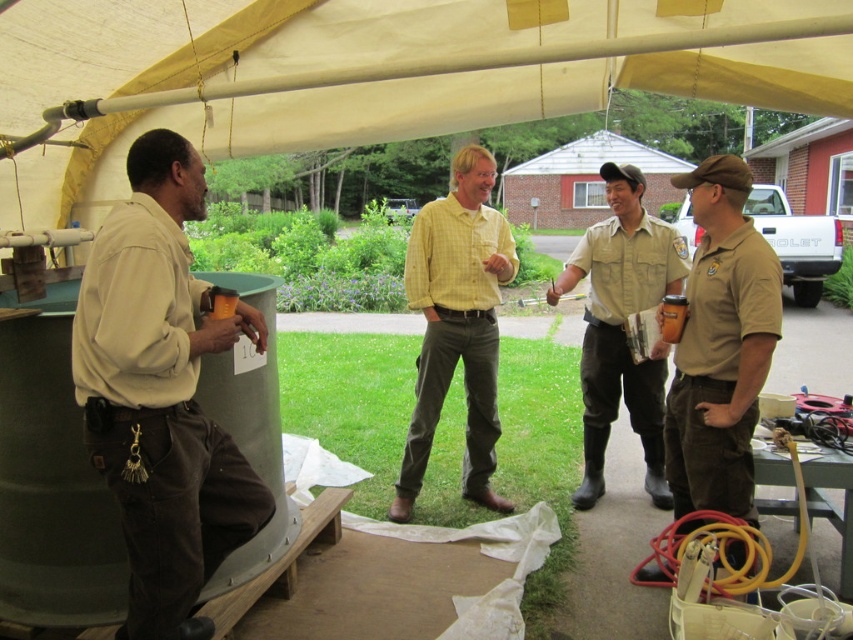
Can you confirm if matte khaki uniform at right is shorter than yellow checkered shirt at center?

Yes, matte khaki uniform at right is shorter than yellow checkered shirt at center.

Based on the photo, between matte khaki uniform at right and yellow checkered shirt at center, which one has more height?

With more height is yellow checkered shirt at center.

Does point (730, 401) lie in front of point (439, 360)?

That is True.

The height and width of the screenshot is (640, 853). Find the location of `matte khaki uniform at right`. matte khaki uniform at right is located at coordinates (720, 346).

Between matte khaki uniform at right and khaki uniform at center, which one has less height?

matte khaki uniform at right is shorter.

Does matte khaki uniform at right come behind khaki uniform at center?

No.

Which is in front, point (701, 170) or point (616, 413)?

Point (701, 170) is more forward.

Identify the location of matte khaki uniform at right. (720, 346).

Between matte khaki shirt at left and matte khaki uniform at right, which one has less height?

matte khaki shirt at left is shorter.

In the scene shown: Is matte khaki shirt at left bigger than matte khaki uniform at right?

Yes, matte khaki shirt at left is bigger than matte khaki uniform at right.

Find the location of a particular element. The image size is (853, 640). matte khaki shirt at left is located at coordinates (161, 394).

This screenshot has width=853, height=640. I want to click on matte khaki shirt at left, so click(161, 394).